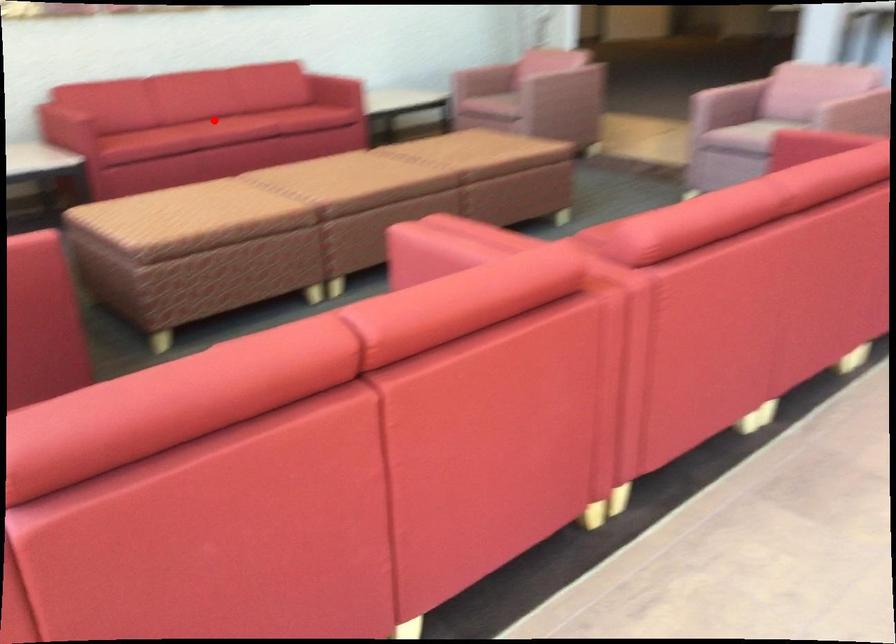
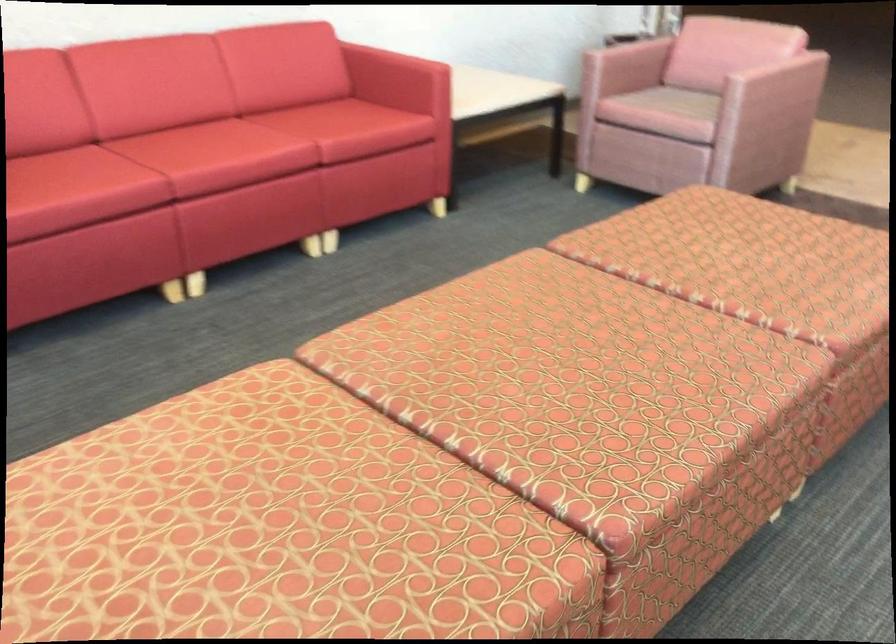
Find the pixel in the second image that matches the highlighted location in the first image.

(196, 144)